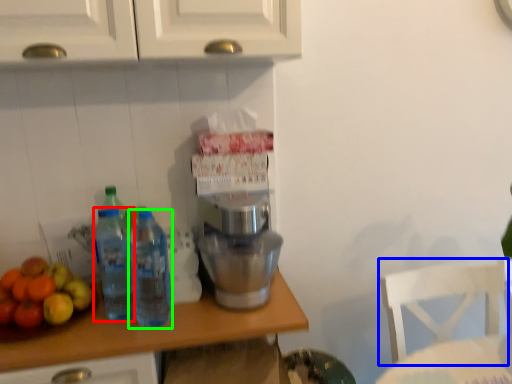
Question: Estimate the real-world distances between objects in this image. Which object is closer to bottle (highlighted by a red box), chair (highlighted by a blue box) or bottle (highlighted by a green box)?

Choices:
 (A) chair
 (B) bottle

Answer: (B)